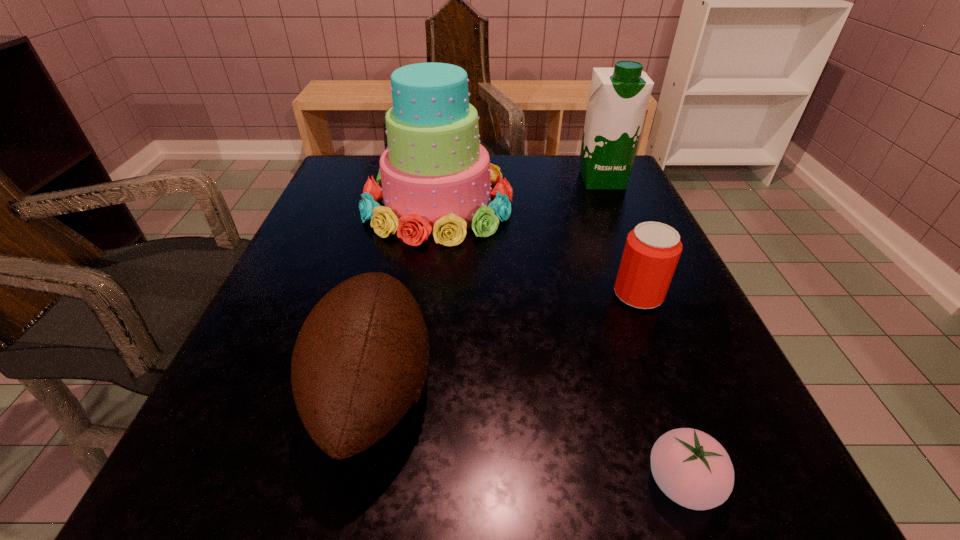
Find the location of `cake`. cake is located at coordinates (435, 178).

This screenshot has width=960, height=540. Find the location of `soya milk`. soya milk is located at coordinates (618, 97).

At what (x,y) coordinates should I click in order to perform the action: click on the third tallest object. Please return your answer as a coordinate pair (x, y). The height and width of the screenshot is (540, 960). Looking at the image, I should click on (360, 360).

At what (x,y) coordinates should I click in order to perform the action: click on the fourth tallest object. Please return your answer as a coordinate pair (x, y). The height and width of the screenshot is (540, 960). Looking at the image, I should click on (652, 250).

Find the location of a particular element. The height and width of the screenshot is (540, 960). beer can is located at coordinates (652, 250).

Find the location of a particular element. The height and width of the screenshot is (540, 960). the shortest object is located at coordinates (693, 469).

Image resolution: width=960 pixels, height=540 pixels. I want to click on vacant space located 0.110m on the front of the cake, so click(426, 287).

You are a GUI agent. You are given a task and a screenshot of the screen. Output one action in this format:
    pyautogui.click(x=<x>, y=<y>)
    Task: Click on the free point located 0.250m on the front-facing side of the soya milk
    Image resolution: width=960 pixels, height=540 pixels.
    Given the screenshot: What is the action you would take?
    pyautogui.click(x=636, y=261)

Identify the location of free region located 0.310m on the laces of the football. The height and width of the screenshot is (540, 960). (658, 390).

This screenshot has height=540, width=960. I want to click on vacant area situated 0.290m on the back of the second shortest object, so click(x=599, y=195).